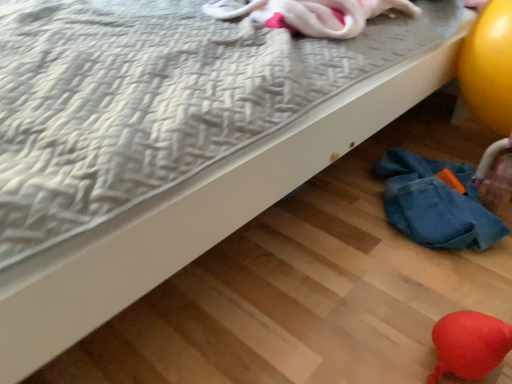
Identify the location of vacant space behind rubberized red balloon at lower right. The width and height of the screenshot is (512, 384). click(x=412, y=300).